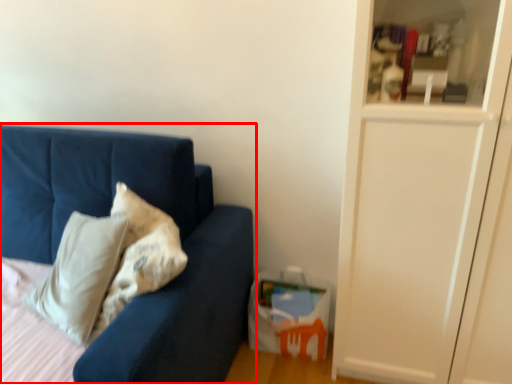
Question: From the image's perspective, considering the relative positions of studio couch (annotated by the red box) and glass door in the image provided, where is studio couch (annotated by the red box) located with respect to the staircase?

Choices:
 (A) above
 (B) below

Answer: (B)